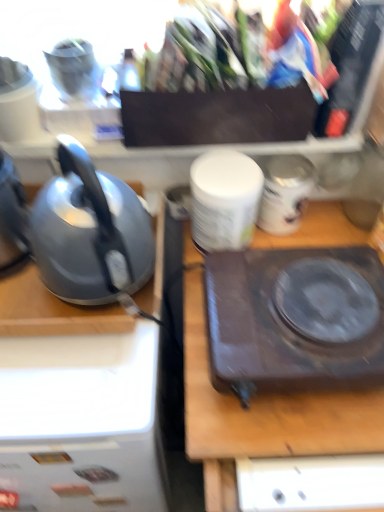
Question: Is point (238, 347) closer or farther from the camera than point (306, 185)?

Choices:
 (A) closer
 (B) farther

Answer: (A)

Question: Considering the relative positions of dark brown plastic hot plate at center and white glossy jar at center in the image provided, is dark brown plastic hot plate at center to the left or to the right of white glossy jar at center?

Choices:
 (A) right
 (B) left

Answer: (B)

Question: Which object is positioned farthest from the brown matte electric stove at center?

Choices:
 (A) satin grey kettle at left
 (B) dark brown plastic hot plate at center
 (C) white matte container at center
 (D) white glossy jar at center

Answer: (A)

Question: Which is farther from the dark brown plastic hot plate at center?

Choices:
 (A) white glossy jar at center
 (B) white matte container at center
 (C) satin grey kettle at left
 (D) brown matte electric stove at center

Answer: (A)